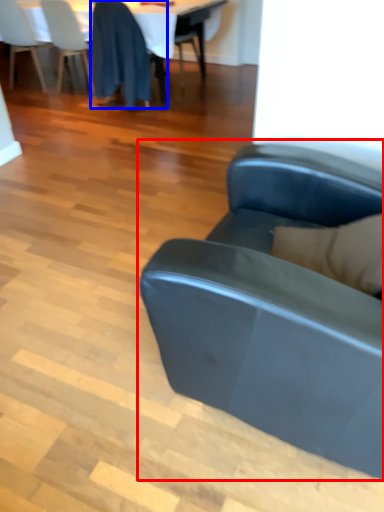
Question: Which object is further to the camera taking this photo, studio couch (highlighted by a red box) or chair (highlighted by a blue box)?

Choices:
 (A) studio couch
 (B) chair

Answer: (B)